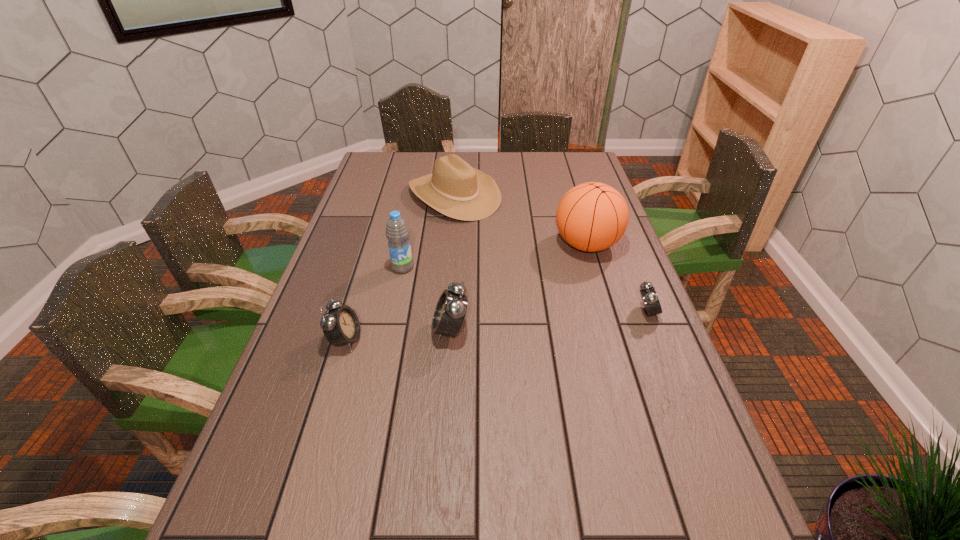
In the image, there is a desktop. In order to click on vacant space at the left edge in this screenshot , I will do `click(351, 267)`.

I want to click on vacant region at the right edge of the desktop, so click(x=629, y=385).

Where is `vacant space at the far right corner of the desktop`? vacant space at the far right corner of the desktop is located at coordinates (553, 160).

Find the location of `vacant space that is in between the second tallest alarm clock and the shortest object`. vacant space that is in between the second tallest alarm clock and the shortest object is located at coordinates (496, 326).

Locate an element on the screen. This screenshot has height=540, width=960. free spot between the rightmost alarm clock and the tallest alarm clock is located at coordinates (549, 321).

I want to click on vacant area that lies between the tallest alarm clock and the leftmost object, so click(398, 335).

What are the coordinates of `vacant space that is in between the basketball and the second tallest alarm clock` in the screenshot? It's located at (467, 292).

This screenshot has width=960, height=540. Find the location of `free spot between the second tallest alarm clock and the shortest alarm clock`. free spot between the second tallest alarm clock and the shortest alarm clock is located at coordinates (496, 326).

Where is `vacant space in between the water bottle and the farthest object`? This screenshot has height=540, width=960. vacant space in between the water bottle and the farthest object is located at coordinates (428, 231).

This screenshot has width=960, height=540. Identify the location of vacant area that lies between the leftmost alarm clock and the tallest alarm clock. (398, 335).